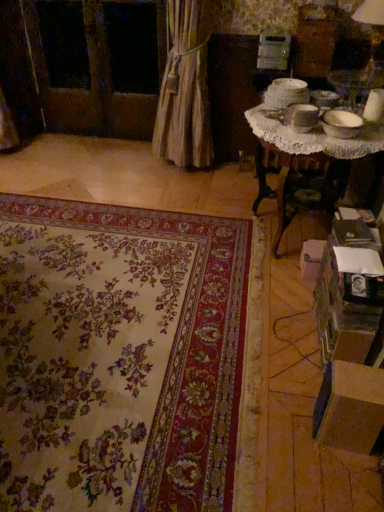
Where is `vacant space to the left of white lace table at upper right`? vacant space to the left of white lace table at upper right is located at coordinates (182, 250).